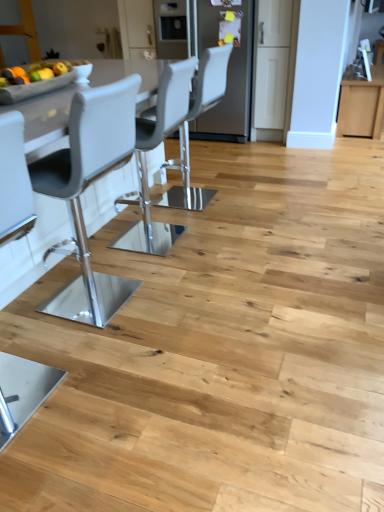
Question: Is matte gray chair at left, the first chair viewed from the left, at the back of matte gray chair at center, placed as the 2th chair when sorted from bottom to top?

Choices:
 (A) no
 (B) yes

Answer: (A)

Question: Can you confirm if matte gray chair at center, marked as the second chair in a front-to-back arrangement, is wider than matte gray chair at left, placed as the second chair when sorted from back to front?

Choices:
 (A) yes
 (B) no

Answer: (A)

Question: From a real-world perspective, does matte gray chair at center, acting as the second chair starting from the left, stand above matte gray chair at left, which is the first chair from front to back?

Choices:
 (A) yes
 (B) no

Answer: (B)

Question: Is the depth of matte gray chair at center, placed as the 2th chair when sorted from bottom to top, less than that of matte gray chair at left, the 2th chair when ordered from right to left?

Choices:
 (A) no
 (B) yes

Answer: (A)

Question: Is the position of matte gray chair at center, marked as the second chair in a front-to-back arrangement, more distant than that of matte gray chair at left, placed as the second chair when sorted from back to front?

Choices:
 (A) yes
 (B) no

Answer: (A)

Question: Is matte gray chair at center, marked as the second chair in a front-to-back arrangement, inside or outside of satin stainless steel refrigerator at center?

Choices:
 (A) outside
 (B) inside

Answer: (A)

Question: Considering their positions, is matte gray chair at center, placed as the 2th chair when sorted from bottom to top, located in front of or behind satin stainless steel refrigerator at center?

Choices:
 (A) behind
 (B) front

Answer: (B)

Question: From the image's perspective, is matte gray chair at center, marked as the second chair in a front-to-back arrangement, located above or below satin stainless steel refrigerator at center?

Choices:
 (A) above
 (B) below

Answer: (B)

Question: From their relative heights in the image, would you say matte gray chair at center, which is counted as the first chair, starting from the top, is taller or shorter than satin stainless steel refrigerator at center?

Choices:
 (A) short
 (B) tall

Answer: (A)

Question: In terms of width, does matte gray chair at center, marked as the second chair in a front-to-back arrangement, look wider or thinner when compared to matte gray chair at left, the first chair viewed from the left?

Choices:
 (A) wide
 (B) thin

Answer: (A)

Question: Is matte gray chair at center, marked as the second chair in a front-to-back arrangement, situated inside matte gray chair at left, which is the first chair from front to back, or outside?

Choices:
 (A) inside
 (B) outside

Answer: (B)

Question: From a real-world perspective, is matte gray chair at center, acting as the first chair starting from the right, above or below matte gray chair at left, acting as the 2th chair starting from the top?

Choices:
 (A) above
 (B) below

Answer: (B)

Question: Is point (221, 87) positioned closer to the camera than point (29, 373)?

Choices:
 (A) closer
 (B) farther

Answer: (B)

Question: Considering the positions of matte gray chair at left, which is counted as the 1th chair, starting from the bottom, and matte gray chair at center, which is counted as the first chair, starting from the top, in the image, is matte gray chair at left, which is counted as the 1th chair, starting from the bottom, bigger or smaller than matte gray chair at center, which is counted as the first chair, starting from the top,?

Choices:
 (A) small
 (B) big

Answer: (A)

Question: From the image's perspective, relative to matte gray chair at center, placed as the 2th chair when sorted from bottom to top, is matte gray chair at left, which is the first chair from front to back, above or below?

Choices:
 (A) above
 (B) below

Answer: (B)